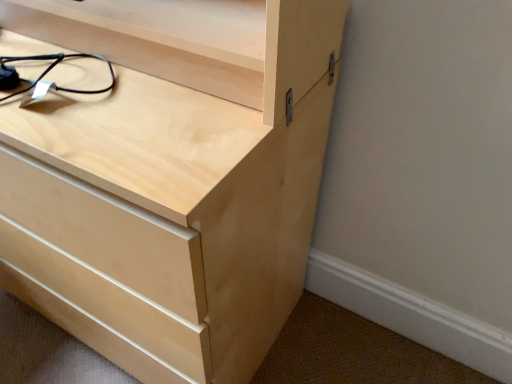
Locate an element on the screen. The width and height of the screenshot is (512, 384). natural wood chest of drawers at center is located at coordinates (170, 177).

What do you see at coordinates (170, 177) in the screenshot?
I see `natural wood chest of drawers at center` at bounding box center [170, 177].

The height and width of the screenshot is (384, 512). I want to click on natural wood chest of drawers at center, so click(170, 177).